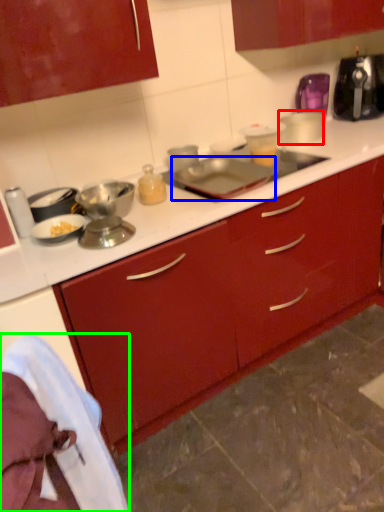
Question: Estimate the real-world distances between objects in this image. Which object is farther from appliance (highlighted by a red box), appliance (highlighted by a blue box) or material (highlighted by a green box)?

Choices:
 (A) appliance
 (B) material

Answer: (B)